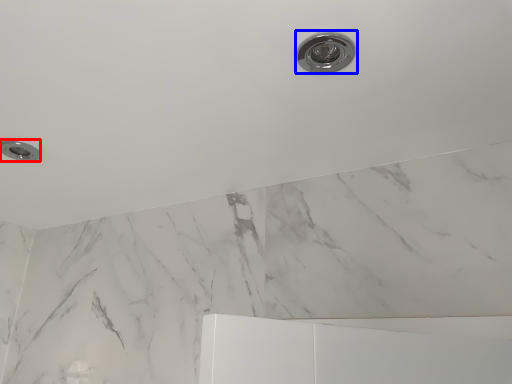
Question: Among these objects, which one is farthest to the camera, knob (highlighted by a red box) or plumbing fixture (highlighted by a blue box)?

Choices:
 (A) knob
 (B) plumbing fixture

Answer: (A)